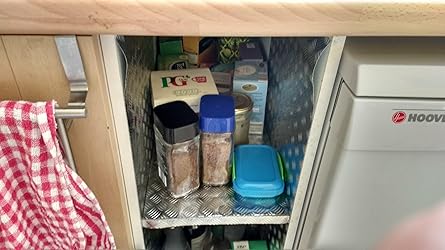
Image resolution: width=445 pixels, height=250 pixels. I want to click on dishtowel, so click(x=22, y=167).